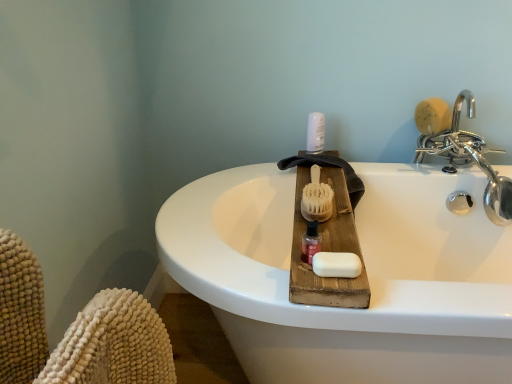
The height and width of the screenshot is (384, 512). Identify the location of vacant area that lies between wooden bristle brush at center, which appears as the second brush when viewed from the top, and white matte soap at center. (331, 224).